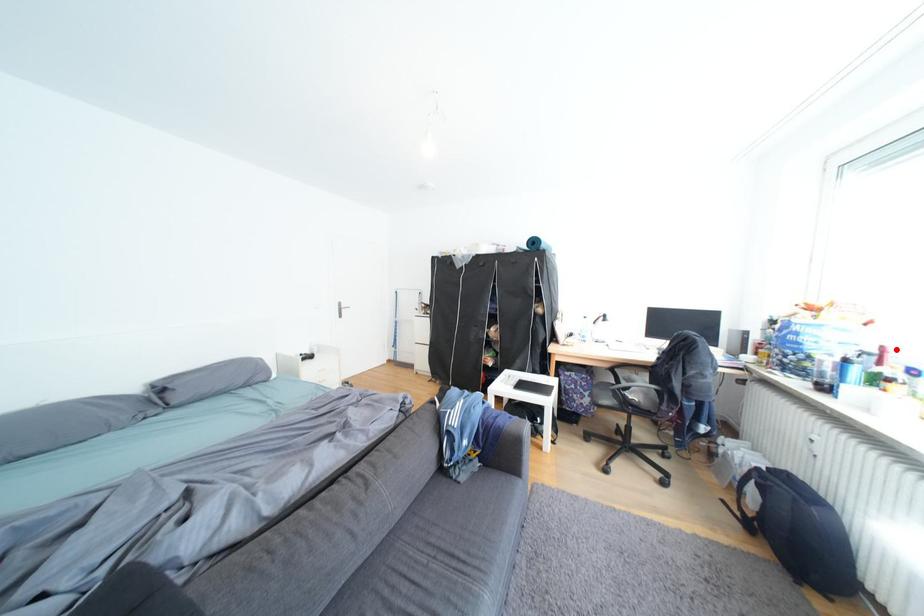
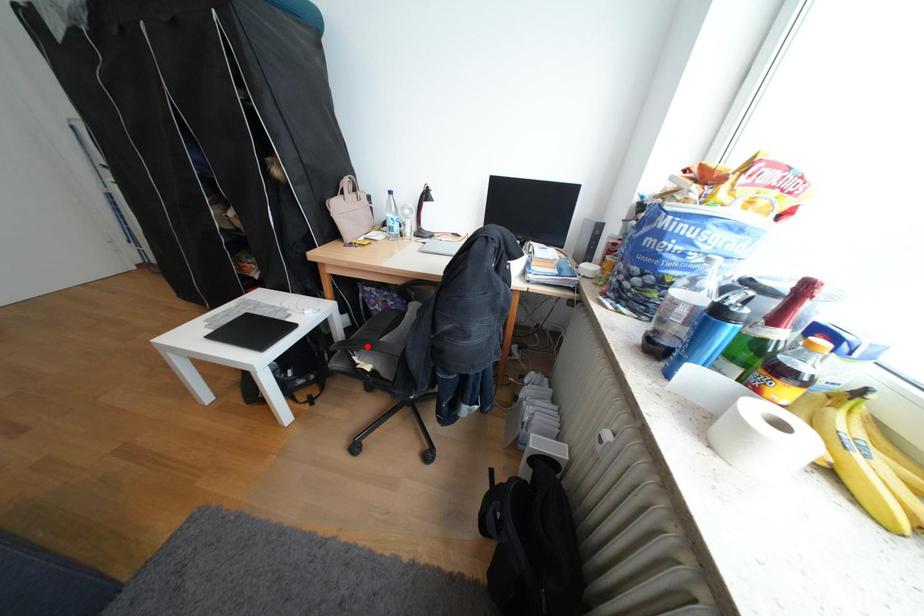
I am providing you with two images of the same scene from different viewpoints. A red point is marked on the first image and another point is marked on the second image. Are the points marked in image1 and image2 representing the same 3D position?

No